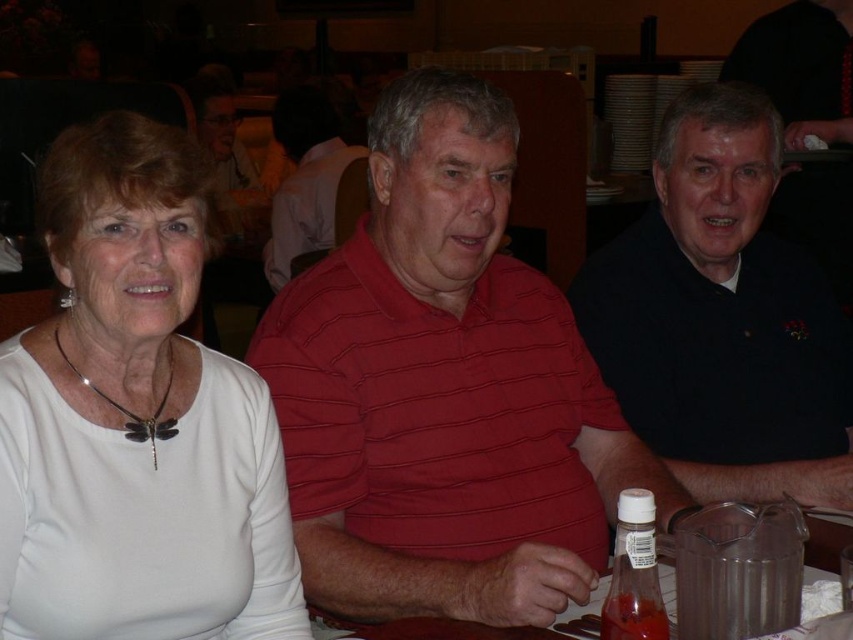
You are a photographer taking a picture of the group. You notice the white matte shirt at left and the red striped shirt at center. Which shirt is positioned lower in the frame?

The white matte shirt at left is positioned below the red striped shirt at center, so it is lower in the frame.

You are a photographer trying to arrange three people for a group photo. You notice the striped cotton shirt at center and the red striped shirt at center. Which of these two shirts is shorter in height?

The striped cotton shirt at center is shorter in height than the red striped shirt at center.